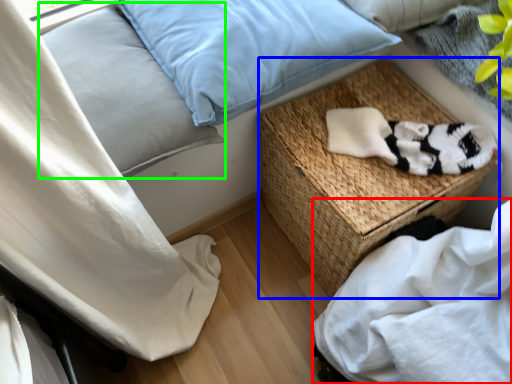
Question: Which is nearer to the sheet (highlighted by a red box)? table (highlighted by a blue box) or pillow (highlighted by a green box).

Choices:
 (A) table
 (B) pillow

Answer: (A)